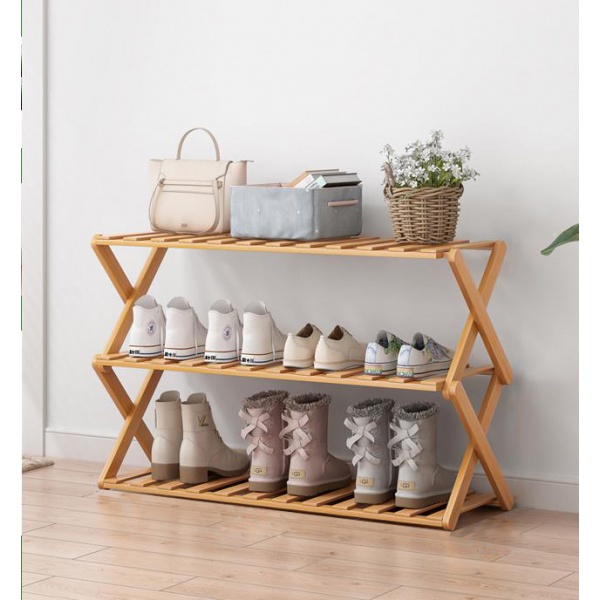
Locate an element on the screen. footwear on second shelf of wooden stand is located at coordinates (423, 356), (375, 354), (334, 349), (303, 345), (244, 339), (234, 336), (191, 328), (141, 320).